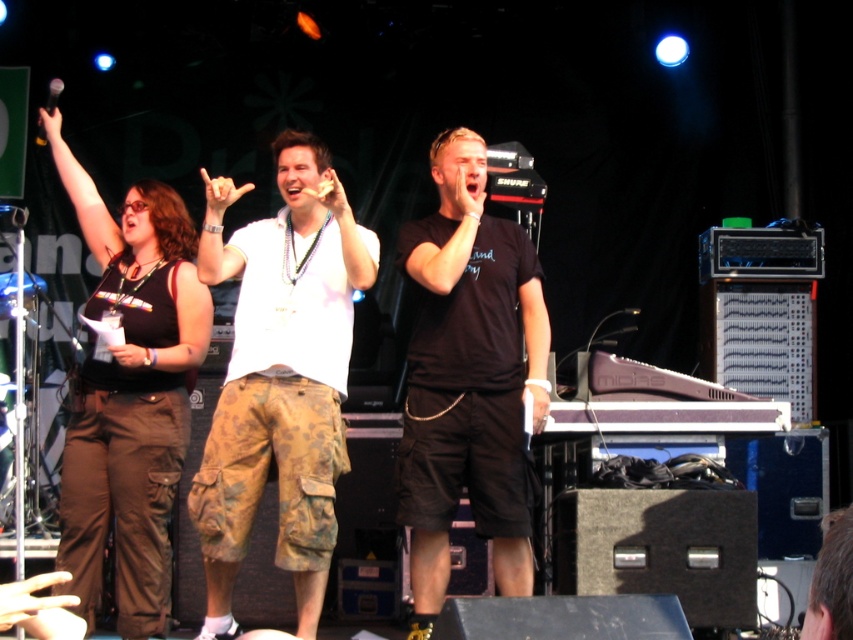
Question: Where is black cotton t-shirt at center located in relation to black matte microphone at upper left in the image?

Choices:
 (A) left
 (B) right

Answer: (B)

Question: Can you confirm if camo shorts at center is bigger than matte black tank top at center?

Choices:
 (A) no
 (B) yes

Answer: (A)

Question: Considering the real-world distances, which object is closest to the matte black tank top at center?

Choices:
 (A) camo shorts at center
 (B) black cotton t-shirt at center
 (C) black matte microphone at upper left

Answer: (A)

Question: Among these objects, which one is nearest to the camera?

Choices:
 (A) black matte microphone at upper left
 (B) matte black tank top at center
 (C) black cotton t-shirt at center
 (D) camo shorts at center

Answer: (D)

Question: Does black cotton t-shirt at center have a lesser width compared to black matte microphone at upper left?

Choices:
 (A) no
 (B) yes

Answer: (A)

Question: Which point is farther from the camera taking this photo?

Choices:
 (A) (479, 412)
 (B) (47, 93)
 (C) (219, 592)

Answer: (B)